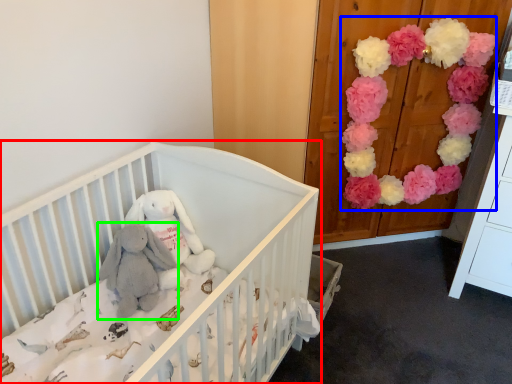
Question: Which is nearer to the infant bed (highlighted by a red box)? flower (highlighted by a blue box) or baby elephant (highlighted by a green box).

Choices:
 (A) flower
 (B) baby elephant

Answer: (B)